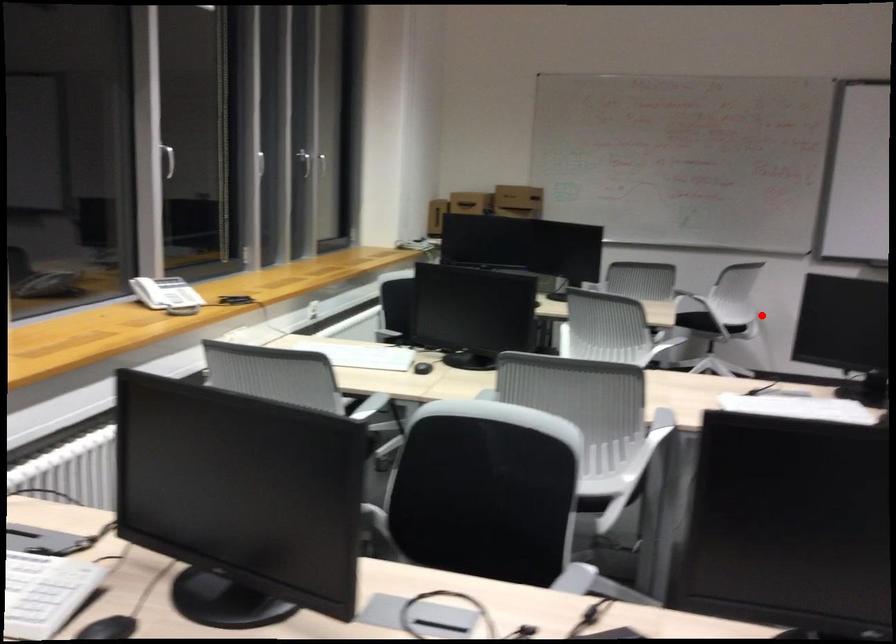
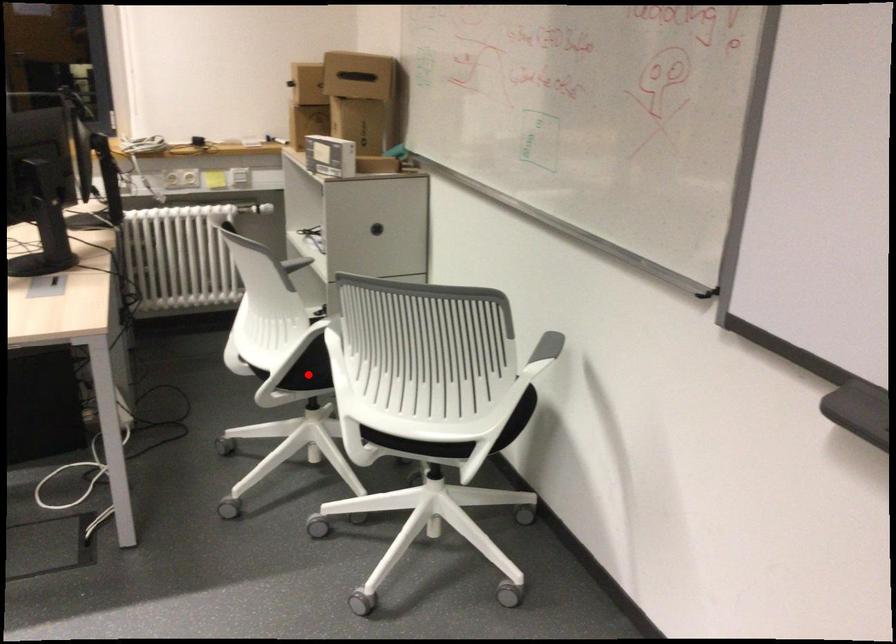
I am providing you with two images of the same scene from different viewpoints. A red point is marked on the first image and another point is marked on the second image. Do the highlighted points in image1 and image2 indicate the same real-world spot?

No